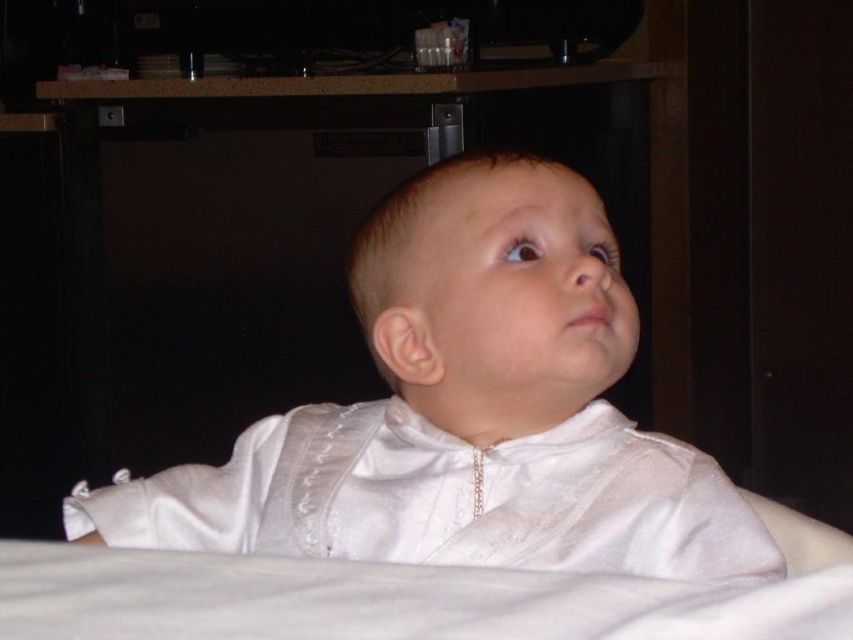
How far apart are white satin baby at center and white satin robe at center?

white satin baby at center is 1.07 inches away from white satin robe at center.

Between white satin baby at center and white satin robe at center, which one appears on the right side from the viewer's perspective?

white satin robe at center is more to the right.

At what (x,y) coordinates should I click in order to perform the action: click on white satin baby at center. Please return your answer as a coordinate pair (x, y). This screenshot has width=853, height=640. Looking at the image, I should click on (466, 412).

Locate an element on the screen. white satin baby at center is located at coordinates (466, 412).